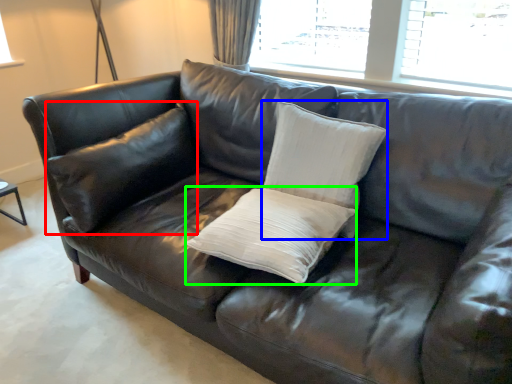
Question: Considering the real-world distances, which object is closest to pillow (highlighted by a red box)? pillow (highlighted by a blue box) or pillow (highlighted by a green box).

Choices:
 (A) pillow
 (B) pillow

Answer: (B)